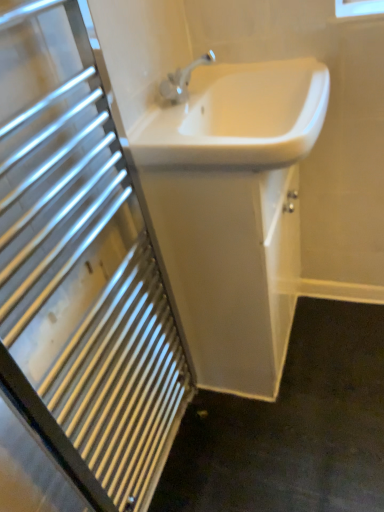
Where is `white glossy sink at upper center`? This screenshot has width=384, height=512. white glossy sink at upper center is located at coordinates (79, 271).

Is white glossy sink at upper center not inside white glossy sink at center, which appears as the 1th sink when ordered from the bottom?

white glossy sink at upper center lies outside white glossy sink at center, which appears as the 1th sink when ordered from the bottom,'s area.

Looking at this image, which of these two, white glossy sink at upper center or white glossy sink at center, which appears as the 2th sink when viewed from the top, is thinner?

white glossy sink at upper center is thinner.

Which of these two, white glossy sink at upper center or white glossy sink at center, which appears as the 1th sink when ordered from the bottom, stands taller?

With more height is white glossy sink at upper center.

Are white glossy sink at upper center and white glossy sink at center, which appears as the 1th sink when ordered from the bottom, far apart?

Actually, white glossy sink at upper center and white glossy sink at center, which appears as the 1th sink when ordered from the bottom, are a little close together.

Which sink is the 2nd one when counting from the back of the white glossy sink at upper center? Please provide its 2D coordinates.

[(232, 212)]

From the image's perspective, which one is positioned lower, white glossy sink at center, which appears as the 1th sink when ordered from the bottom, or white glossy sink at upper center?

white glossy sink at upper center, from the image's perspective.

Is the surface of white glossy sink at center, which appears as the 1th sink when ordered from the bottom, in direct contact with white glossy sink at upper center?

No, white glossy sink at center, which appears as the 1th sink when ordered from the bottom, is not with white glossy sink at upper center.

Can you confirm if white glossy sink at center, which appears as the 2th sink when viewed from the top, is taller than white glossy sink at upper center?

No.

From the image's perspective, is white glossy sink at center, which appears as the 2th sink when viewed from the top, above white glossy sink at center, which is the 2th sink from bottom to top?

No, from the image's perspective, white glossy sink at center, which appears as the 2th sink when viewed from the top, is not on top of white glossy sink at center, which is the 2th sink from bottom to top.

Does white glossy sink at center, which appears as the 1th sink when ordered from the bottom, have a lesser width compared to white glossy sink at center, arranged as the first sink when viewed from the top?

Yes, white glossy sink at center, which appears as the 1th sink when ordered from the bottom, is thinner than white glossy sink at center, arranged as the first sink when viewed from the top.

Consider the image. From a real-world perspective, is white glossy sink at center, which appears as the 2th sink when viewed from the top, physically located above or below white glossy sink at center, arranged as the first sink when viewed from the top?

In terms of real-world spatial position, white glossy sink at center, which appears as the 2th sink when viewed from the top, is below white glossy sink at center, arranged as the first sink when viewed from the top.

Is point (200, 207) closer or farther from the camera than point (276, 164)?

Point (200, 207) appears to be farther away from the viewer than point (276, 164).

Is white glossy sink at center, arranged as the first sink when viewed from the top, aimed at white glossy sink at center, which appears as the 2th sink when viewed from the top?

No, white glossy sink at center, arranged as the first sink when viewed from the top, is not oriented towards white glossy sink at center, which appears as the 2th sink when viewed from the top.

How many degrees apart are the facing directions of white glossy sink at center, which is the 2th sink from bottom to top, and white glossy sink at center, which appears as the 1th sink when ordered from the bottom?

The angle between the facing direction of white glossy sink at center, which is the 2th sink from bottom to top, and the facing direction of white glossy sink at center, which appears as the 1th sink when ordered from the bottom, is 0.00138 degrees.

Considering the relative sizes of white glossy sink at center, which is the 2th sink from bottom to top, and white glossy sink at center, which appears as the 2th sink when viewed from the top, in the image provided, is white glossy sink at center, which is the 2th sink from bottom to top, wider than white glossy sink at center, which appears as the 2th sink when viewed from the top,?

Indeed, white glossy sink at center, which is the 2th sink from bottom to top, has a greater width compared to white glossy sink at center, which appears as the 2th sink when viewed from the top.

From a real-world perspective, which object stands above the other?

In real-world perspective, white glossy sink at center, arranged as the first sink when viewed from the top, is above.

Could you tell me if white glossy sink at center, arranged as the first sink when viewed from the top, is facing white glossy sink at upper center?

No, white glossy sink at center, arranged as the first sink when viewed from the top, is not oriented towards white glossy sink at upper center.

Does white glossy sink at center, arranged as the first sink when viewed from the top, have a greater height compared to white glossy sink at upper center?

In fact, white glossy sink at center, arranged as the first sink when viewed from the top, may be shorter than white glossy sink at upper center.

Does white glossy sink at upper center have a greater height compared to white glossy sink at center, arranged as the first sink when viewed from the top?

Yes, white glossy sink at upper center is taller than white glossy sink at center, arranged as the first sink when viewed from the top.

From a real-world perspective, is white glossy sink at upper center beneath white glossy sink at center, which is the 2th sink from bottom to top?

Correct, in the physical world, white glossy sink at upper center is lower than white glossy sink at center, which is the 2th sink from bottom to top.

Does point (3, 109) come closer to viewer compared to point (271, 95)?

Yes, point (3, 109) is closer to viewer.

Find the location of `bathroom cabinet below the white glossy sink at center, which appears as the 2th sink when viewed from the top (from the image's perspective)`. bathroom cabinet below the white glossy sink at center, which appears as the 2th sink when viewed from the top (from the image's perspective) is located at coordinates (79, 271).

This screenshot has width=384, height=512. What are the coordinates of `bathroom cabinet located on the left of white glossy sink at center, which appears as the 1th sink when ordered from the bottom` in the screenshot? It's located at (79, 271).

When comparing their distances from white glossy sink at center, arranged as the first sink when viewed from the top, does white glossy sink at upper center or white glossy sink at center, which appears as the 2th sink when viewed from the top, seem closer?

Based on the image, white glossy sink at center, which appears as the 2th sink when viewed from the top, appears to be nearer to white glossy sink at center, arranged as the first sink when viewed from the top.

Looking at the image, which one is located closer to white glossy sink at center, which appears as the 2th sink when viewed from the top, white glossy sink at center, which is the 2th sink from bottom to top, or white glossy sink at upper center?

white glossy sink at center, which is the 2th sink from bottom to top.

Looking at the image, which one is located further to white glossy sink at center, which appears as the 1th sink when ordered from the bottom, white glossy sink at upper center or white glossy sink at center, arranged as the first sink when viewed from the top?

The object further to white glossy sink at center, which appears as the 1th sink when ordered from the bottom, is white glossy sink at upper center.

Based on their spatial positions, is white glossy sink at center, which appears as the 1th sink when ordered from the bottom, or white glossy sink at center, arranged as the first sink when viewed from the top, further from white glossy sink at upper center?

Among the two, white glossy sink at center, arranged as the first sink when viewed from the top, is located further to white glossy sink at upper center.

Looking at the image, which one is located further to white glossy sink at upper center, white glossy sink at center, arranged as the first sink when viewed from the top, or white glossy sink at center, which appears as the 2th sink when viewed from the top?

white glossy sink at center, arranged as the first sink when viewed from the top, lies further to white glossy sink at upper center than the other object.

Based on their spatial positions, is white glossy sink at center, which appears as the 1th sink when ordered from the bottom, or white glossy sink at upper center closer to white glossy sink at center, arranged as the first sink when viewed from the top?

white glossy sink at center, which appears as the 1th sink when ordered from the bottom, is closer to white glossy sink at center, arranged as the first sink when viewed from the top.

In order to click on sink between white glossy sink at upper center and white glossy sink at center, which appears as the 2th sink when viewed from the top, in the front-back direction in this screenshot , I will do `click(236, 116)`.